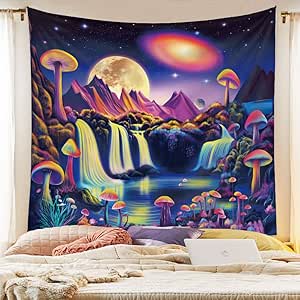
This screenshot has width=300, height=300. I want to click on two curtain rods, so click(290, 19), click(144, 8), click(24, 15).